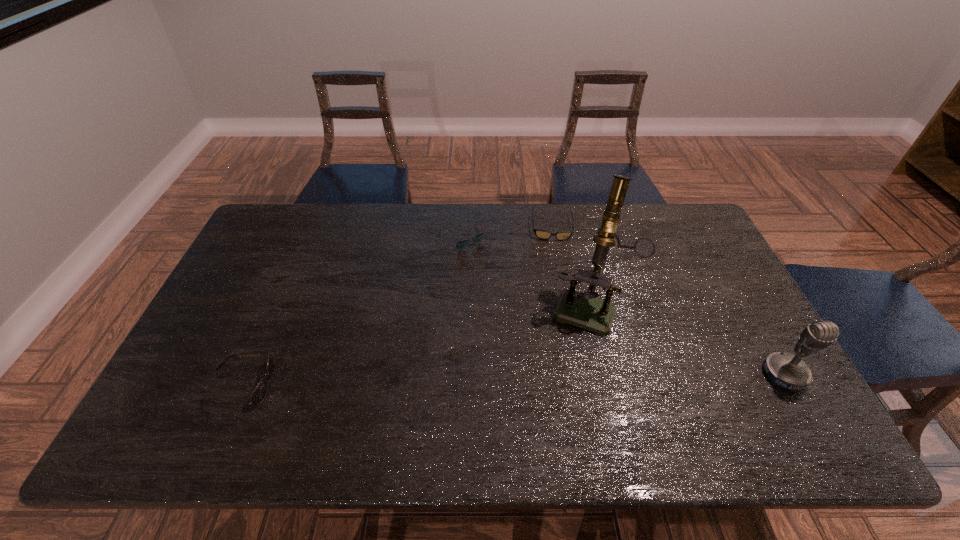
Where is `the closest object to the rightmost sunglasses`? The height and width of the screenshot is (540, 960). the closest object to the rightmost sunglasses is located at coordinates (460, 245).

Identify the location of object that ranks as the fourth closest to the second tallest object. (259, 393).

Find the location of a particular element. The width and height of the screenshot is (960, 540). sunglasses that is the second closest to the leftmost sunglasses is located at coordinates (541, 234).

Locate which sunglasses is the closest to the second object from left to right. Please provide its 2D coordinates. Your answer should be formatted as a tuple, i.e. [(x, y)], where the tuple contains the x and y coordinates of a point satisfying the conditions above.

[(541, 234)]

The width and height of the screenshot is (960, 540). Find the location of `vacant space that satisfies the following two spatial constraints: 1. on the back side of the rightmost sunglasses; 2. on the right side of the second object from left to right`. vacant space that satisfies the following two spatial constraints: 1. on the back side of the rightmost sunglasses; 2. on the right side of the second object from left to right is located at coordinates click(462, 227).